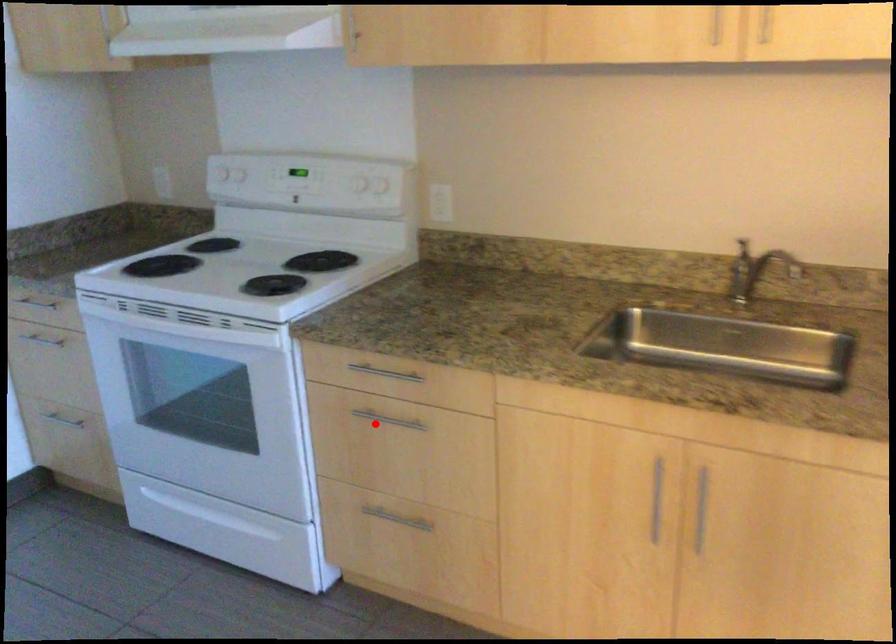
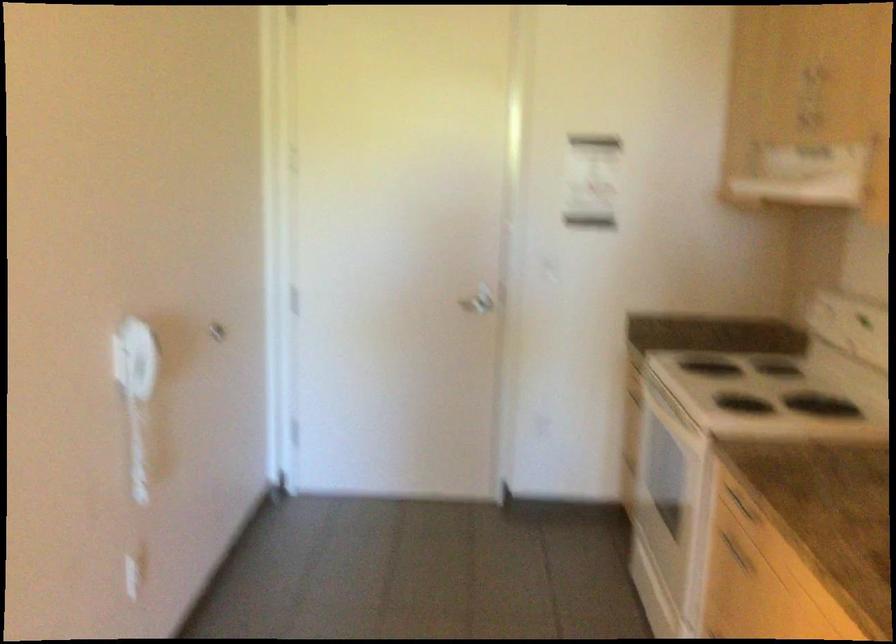
The point at the highlighted location is marked in the first image. Where is the corresponding point in the second image?

(735, 552)